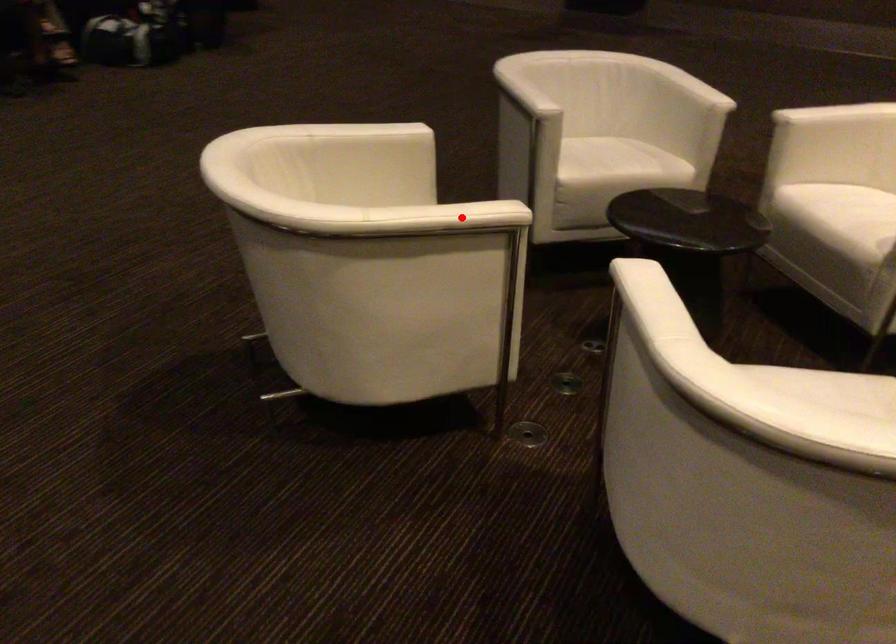
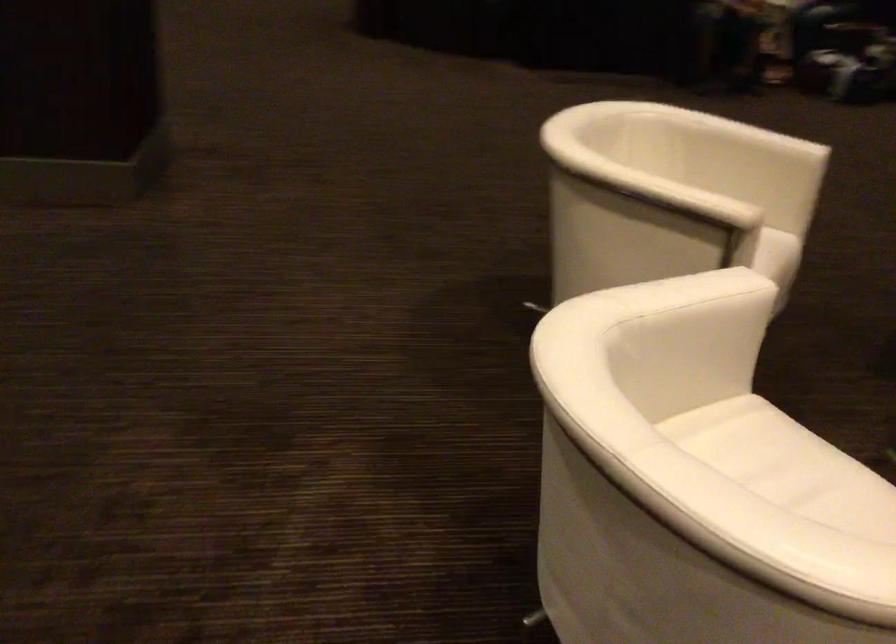
Find the pixel in the second image that matches the highlighted location in the first image.

(675, 194)